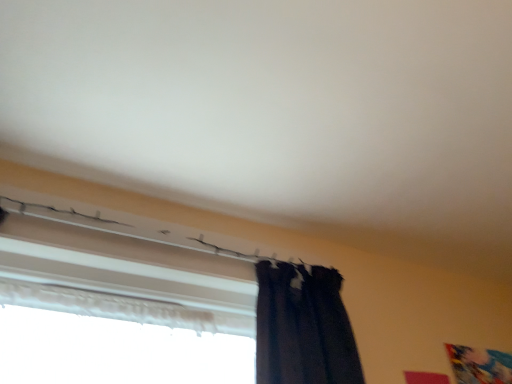
The width and height of the screenshot is (512, 384). What do you see at coordinates (117, 336) in the screenshot? I see `white matte window at upper center` at bounding box center [117, 336].

Measure the distance between point (x=196, y=330) and camera.

The depth of point (x=196, y=330) is 3.95 feet.

The height and width of the screenshot is (384, 512). I want to click on white matte window at upper center, so click(117, 336).

The height and width of the screenshot is (384, 512). I want to click on white matte window at upper center, so click(117, 336).